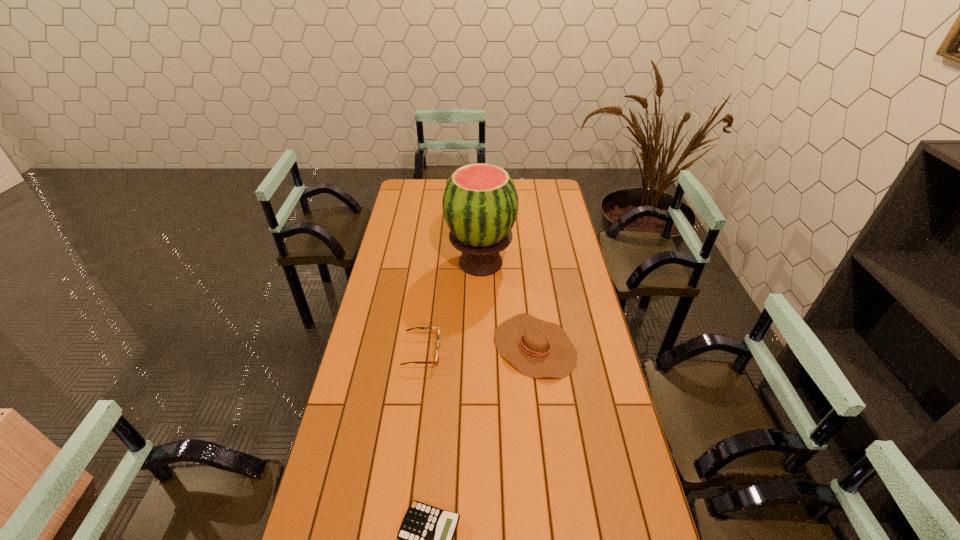
You are a GUI agent. You are given a task and a screenshot of the screen. Output one action in this format:
    pyautogui.click(x=<x>, y=<y>)
    Task: Click on the tallest object
    Image resolution: width=960 pixels, height=540 pixels.
    Given the screenshot: What is the action you would take?
    pyautogui.click(x=480, y=202)

This screenshot has width=960, height=540. Find the location of `watermelon`. watermelon is located at coordinates (480, 202).

What are the coordinates of `cowboy hat` in the screenshot? It's located at (537, 348).

Where is `spectacles`? This screenshot has width=960, height=540. spectacles is located at coordinates (438, 344).

Find the location of `blank area located 0.070m on the left of the watermelon`. blank area located 0.070m on the left of the watermelon is located at coordinates (430, 262).

The image size is (960, 540). What are the coordinates of `vacant space located on the front of the cowboy hat` in the screenshot? It's located at (546, 439).

You are a GUI agent. You are given a task and a screenshot of the screen. Output one action in this format:
    pyautogui.click(x=<x>, y=<y>)
    Task: Click on the vacant space situated 0.070m on the frame of the spectacles
    This screenshot has height=540, width=960.
    Given the screenshot: What is the action you would take?
    pyautogui.click(x=460, y=352)

This screenshot has width=960, height=540. I want to click on object that is at the right edge, so click(537, 348).

Where is `vacant space at the far edge of the desktop`? The image size is (960, 540). vacant space at the far edge of the desktop is located at coordinates (524, 188).

Image resolution: width=960 pixels, height=540 pixels. I want to click on blank space at the left edge of the desktop, so click(398, 352).